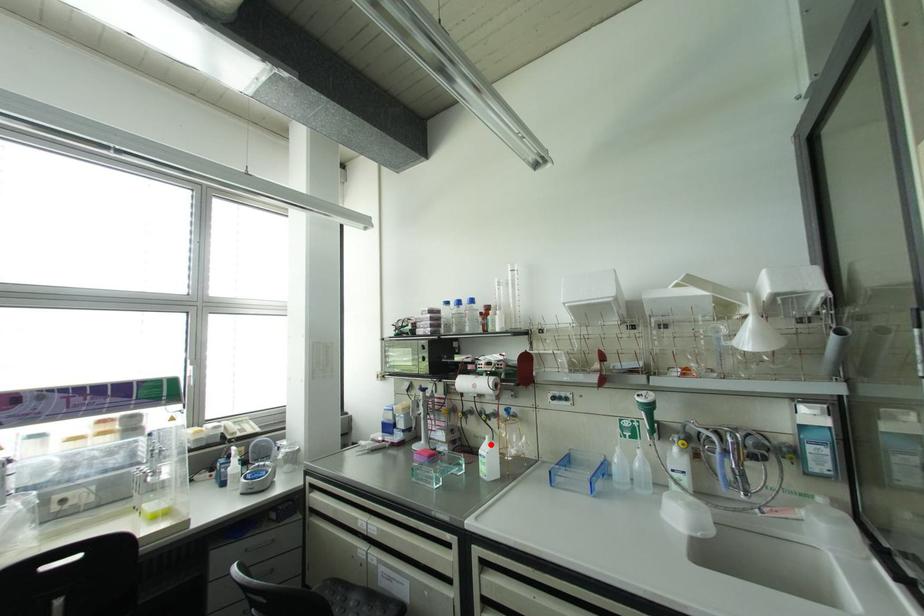
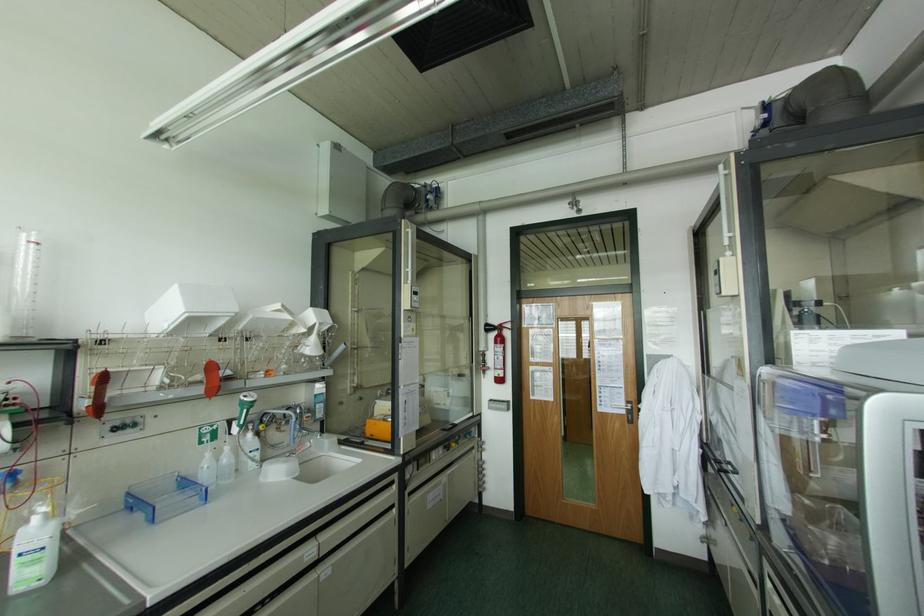
Question: I am providing you with two images of the same scene from different viewpoints. A red point is shown in image1. For the corresponding object point in image2, is it positioned nearer or farther from the camera?

Choices:
 (A) Nearer
 (B) Farther

Answer: (A)